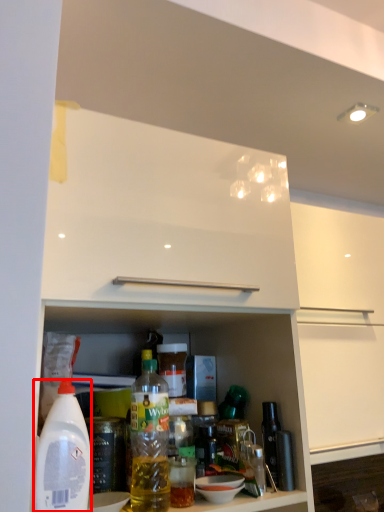
Question: In this image, where is bottle (annotated by the red box) located relative to bottle?

Choices:
 (A) right
 (B) left

Answer: (B)